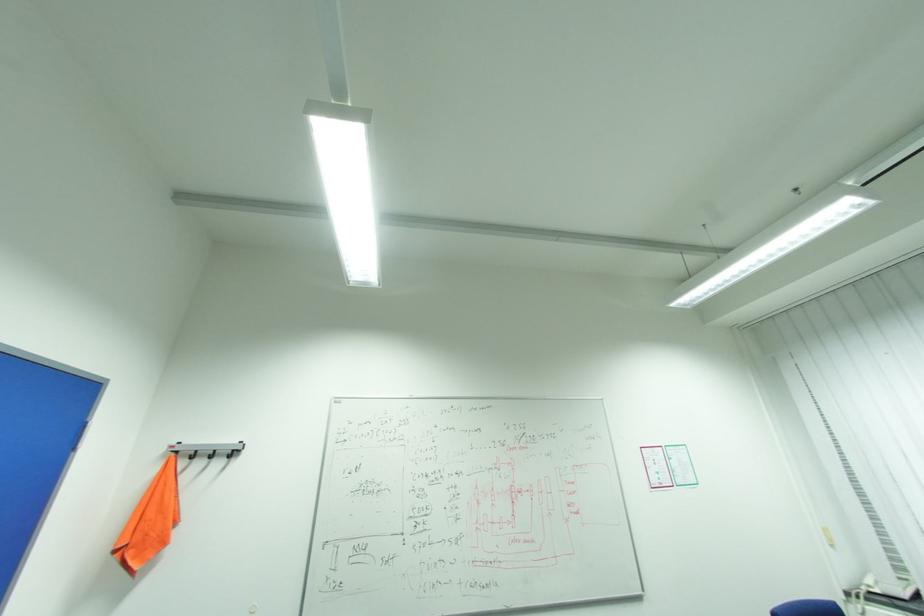
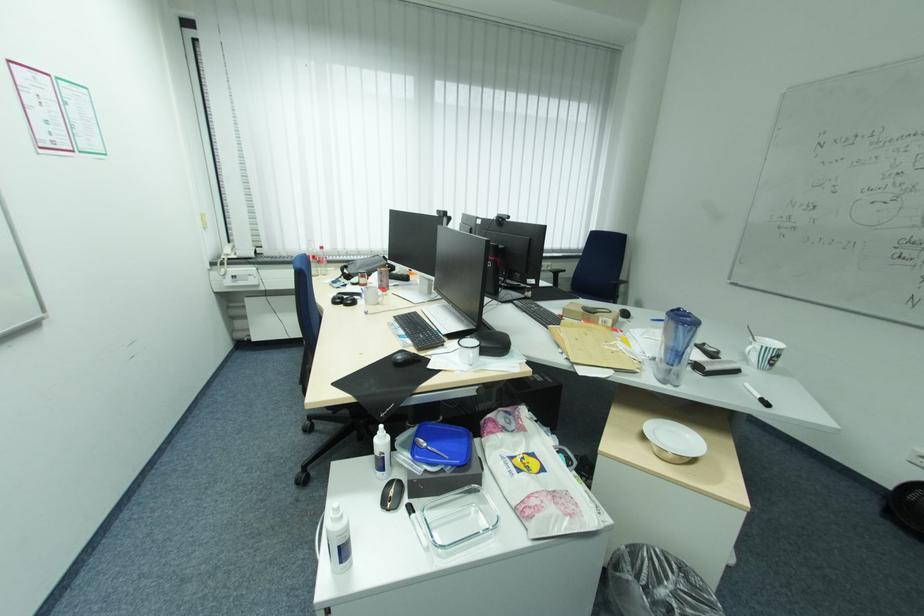
Locate, in the second image, the point that corresponds to (x=876, y=586) in the first image.

(234, 254)